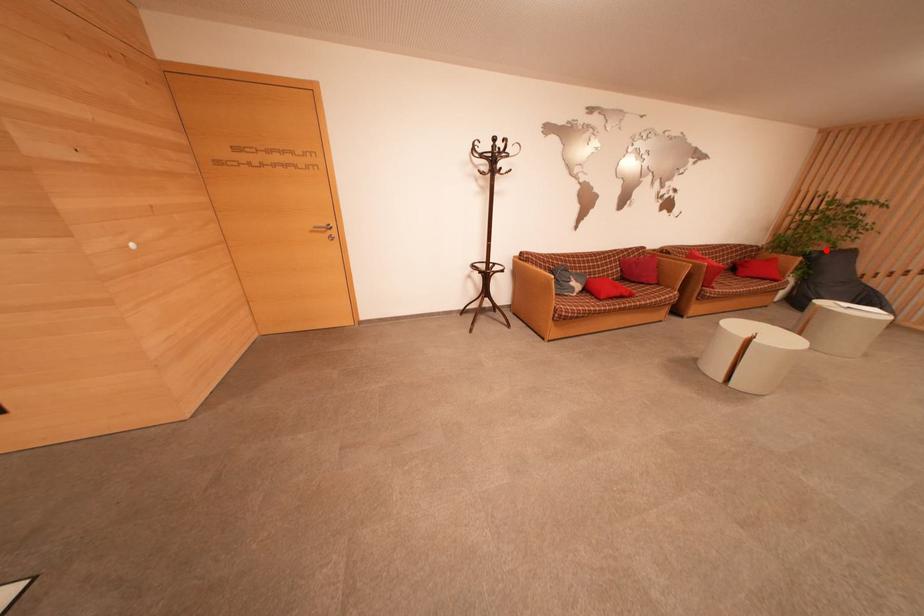
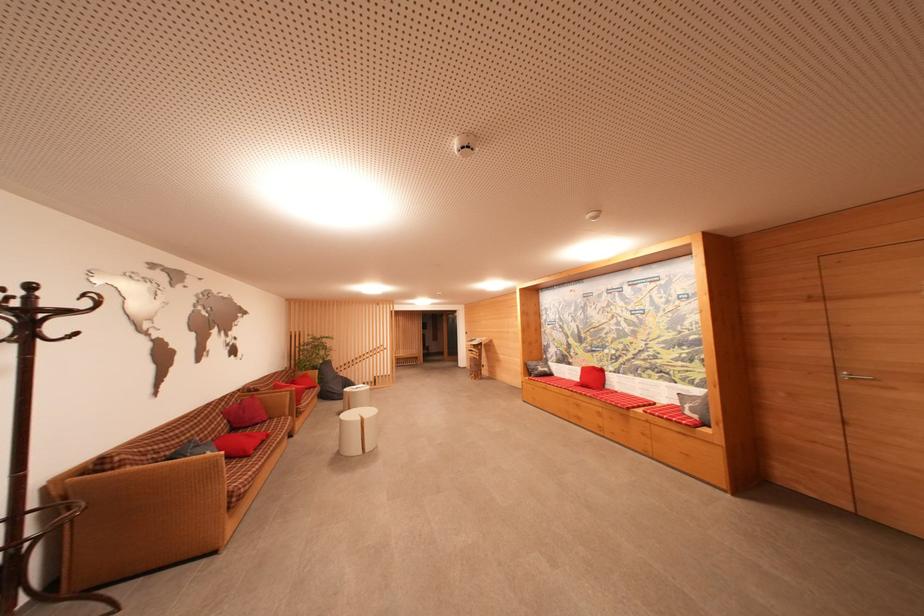
Question: I am providing you with two images of the same scene from different viewpoints. In image1, a red point is highlighted. Considering the same 3D point in image2, which of the following is correct?

Choices:
 (A) It is closer
 (B) It is farther

Answer: (A)